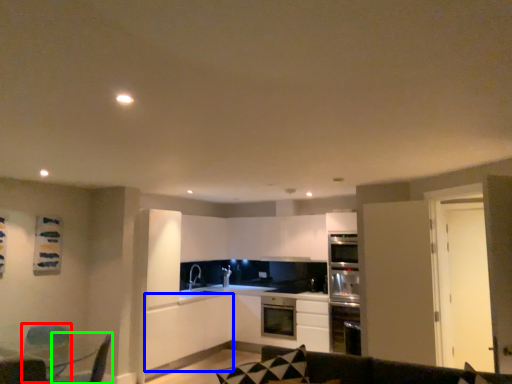
Question: Based on their relative distances, which object is farther from swivel chair (highlighted by a red box)? Choose from cabinetry (highlighted by a blue box) and swivel chair (highlighted by a green box).

Choices:
 (A) cabinetry
 (B) swivel chair

Answer: (A)